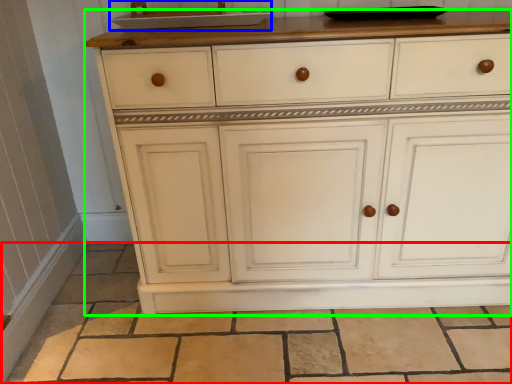
Question: Based on their relative distances, which object is nearer to tile (highlighted by a red box)? Choose from sink (highlighted by a blue box) and chest of drawers (highlighted by a green box).

Choices:
 (A) sink
 (B) chest of drawers

Answer: (B)